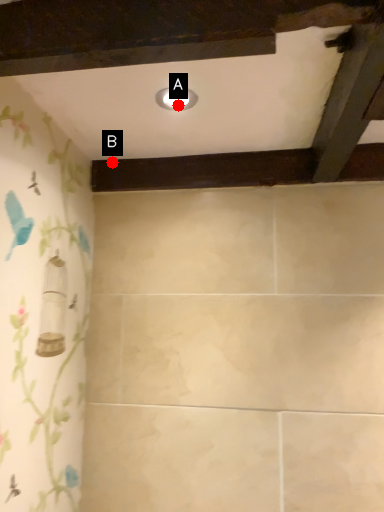
Question: Two points are circled on the image, labeled by A and B beside each circle. Which point is closer to the camera?

Choices:
 (A) A is closer
 (B) B is closer

Answer: (A)